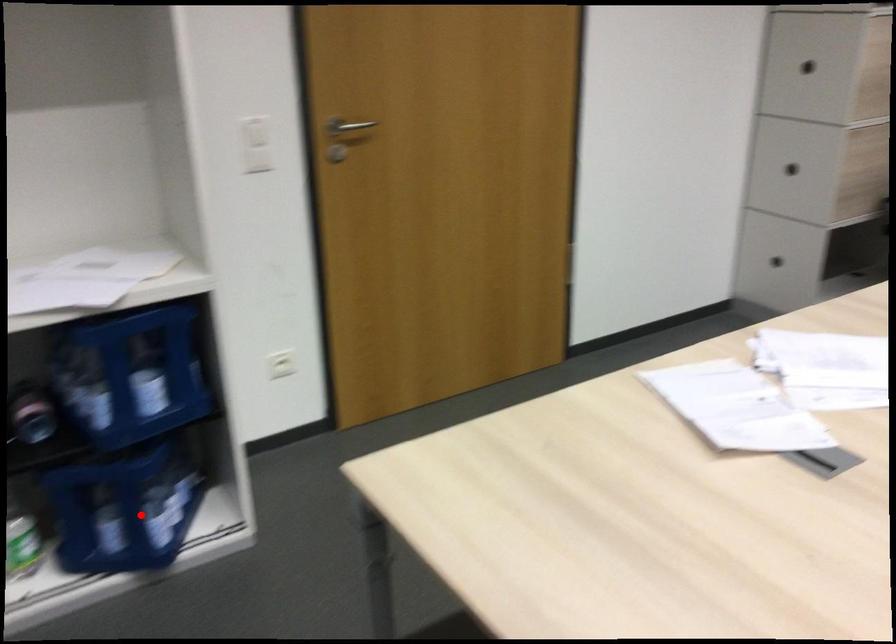
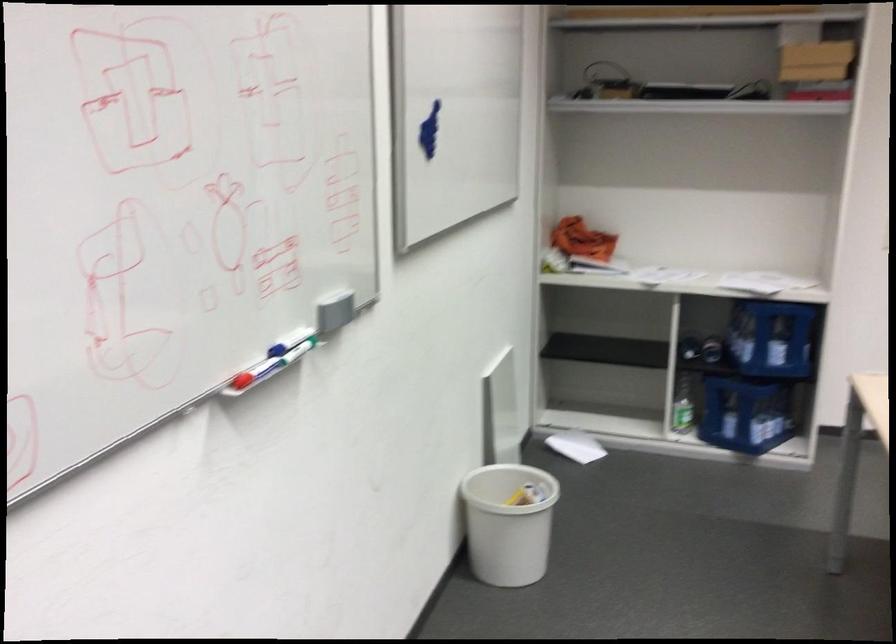
The point at the highlighted location is marked in the first image. Where is the corresponding point in the second image?

(745, 413)